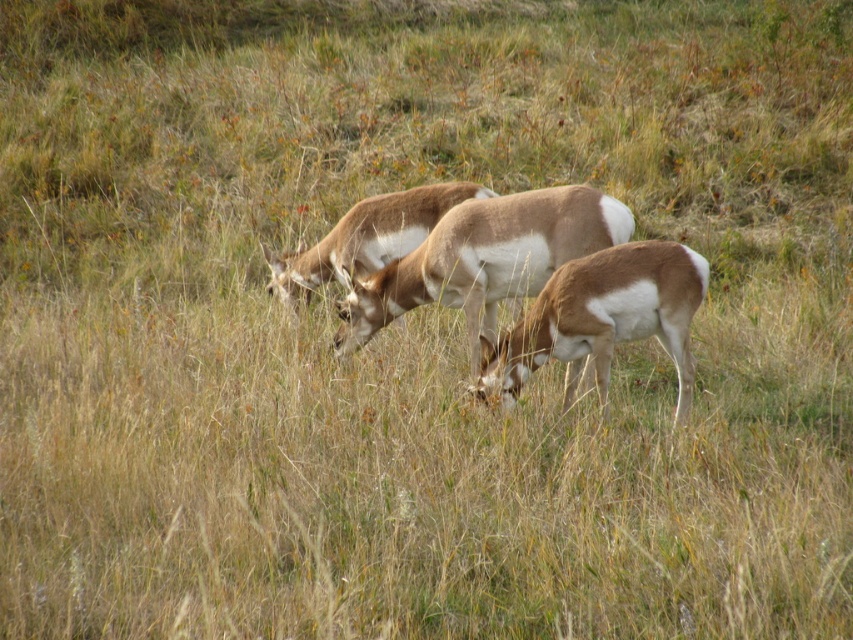
You are a wildlife photographer aiming to capture a photo of the brown speckled antelope at center and the brown velvet antelope at center. Which antelope is positioned further away from you?

The brown velvet antelope at center is positioned behind the brown speckled antelope at center, so it is further away from you.

You are standing at the origin point in the grassy field. You see a point marked at coordinates (602, 317). Which animal is located at that point?

A: The point at coordinates (602, 317) corresponds to the brown velvet antelope at center.